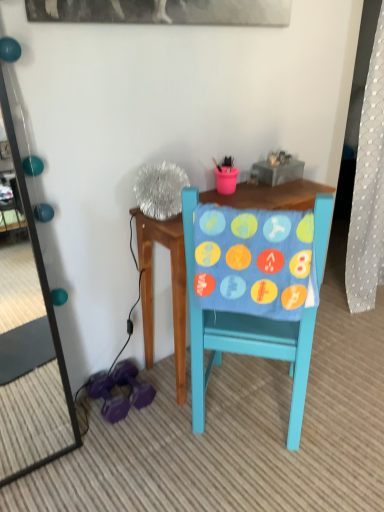
At what (x,y) coordinates should I click in order to perform the action: click on free spot below matte blue chair at center (from a real-world perspective). Please return your answer as a coordinate pair (x, y). Image resolution: width=384 pixels, height=512 pixels. Looking at the image, I should click on (252, 409).